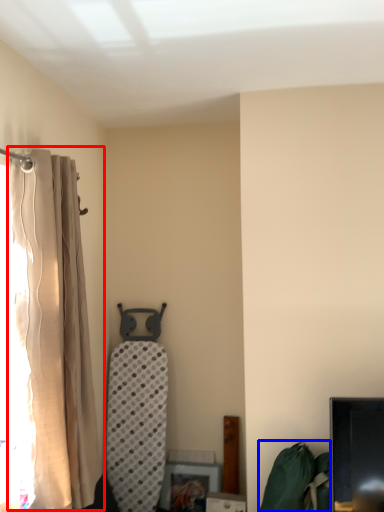
Question: Which of the following is the farthest to the observer, curtain (highlighted by a red box) or bean bag chair (highlighted by a blue box)?

Choices:
 (A) curtain
 (B) bean bag chair

Answer: (B)